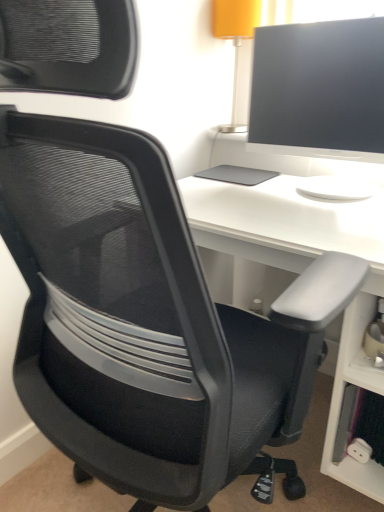
You are a GUI agent. You are given a task and a screenshot of the screen. Output one action in this format:
    pyautogui.click(x=<x>, y=<y>)
    Task: Click on the matte black monitor at upper right
    The width and height of the screenshot is (384, 512).
    Given the screenshot: What is the action you would take?
    pyautogui.click(x=320, y=89)

Measure the distance between point (373,59) and camera.

Point (373,59) and camera are 39.06 inches apart.

Describe the element at coordinates (320, 89) in the screenshot. This screenshot has height=512, width=384. I see `matte black monitor at upper right` at that location.

The width and height of the screenshot is (384, 512). What do you see at coordinates (302, 271) in the screenshot? I see `white matte desk at center` at bounding box center [302, 271].

Where is `white matte desk at center`? The height and width of the screenshot is (512, 384). white matte desk at center is located at coordinates (302, 271).

At what (x,y) coordinates should I click in order to perform the action: click on matte black monitor at upper right. Please return your answer as a coordinate pair (x, y). Looking at the image, I should click on (320, 89).

Can you confirm if matte black monitor at upper right is positioned to the right of white matte desk at center?

Correct, you'll find matte black monitor at upper right to the right of white matte desk at center.

Does matte black monitor at upper right lie behind white matte desk at center?

Yes, matte black monitor at upper right is behind white matte desk at center.

Which is behind, point (365, 115) or point (213, 217)?

The point (365, 115) is more distant.

From the image's perspective, is matte black monitor at upper right below white matte desk at center?

No, from the image's perspective, matte black monitor at upper right is not below white matte desk at center.

From a real-world perspective, does matte black monitor at upper right sit lower than white matte desk at center?

No, from a real-world perspective, matte black monitor at upper right is not below white matte desk at center.

Considering the sizes of objects matte black monitor at upper right and white matte desk at center in the image provided, who is wider, matte black monitor at upper right or white matte desk at center?

With larger width is white matte desk at center.

Is matte black monitor at upper right taller than white matte desk at center?

Incorrect, the height of matte black monitor at upper right is not larger of that of white matte desk at center.

Who is bigger, matte black monitor at upper right or white matte desk at center?

white matte desk at center is bigger.

Can we say matte black monitor at upper right lies outside white matte desk at center?

Indeed, matte black monitor at upper right is completely outside white matte desk at center.

Is matte black monitor at upper right placed right next to white matte desk at center?

No, matte black monitor at upper right is not making contact with white matte desk at center.

Is matte black monitor at upper right oriented towards white matte desk at center?

No, matte black monitor at upper right does not turn towards white matte desk at center.

What's the angular difference between matte black monitor at upper right and white matte desk at center's facing directions?

0.792 degrees separate the facing orientations of matte black monitor at upper right and white matte desk at center.

Where is `desk below the matte black monitor at upper right (from a real-world perspective)`? desk below the matte black monitor at upper right (from a real-world perspective) is located at coordinates (302, 271).

Which object is positioned more to the left, white matte desk at center or matte black monitor at upper right?

From the viewer's perspective, white matte desk at center appears more on the left side.

Does white matte desk at center lie behind matte black monitor at upper right?

No, the depth of white matte desk at center is less than that of matte black monitor at upper right.

Considering the positions of point (253, 231) and point (361, 140), is point (253, 231) closer or farther from the camera than point (361, 140)?

Point (253, 231) is closer to the camera than point (361, 140).

Looking at this image, from the image's perspective, relative to matte black monitor at upper right, is white matte desk at center above or below?

white matte desk at center is situated lower than matte black monitor at upper right in the image.

From a real-world perspective, is white matte desk at center on top of matte black monitor at upper right?

Actually, white matte desk at center is physically below matte black monitor at upper right in the real world.

Which of these two, white matte desk at center or matte black monitor at upper right, is wider?

With larger width is white matte desk at center.

Between white matte desk at center and matte black monitor at upper right, which one has less height?

With less height is matte black monitor at upper right.

Is white matte desk at center smaller than matte black monitor at upper right?

Incorrect, white matte desk at center is not smaller in size than matte black monitor at upper right.

Is matte black monitor at upper right completely or partially inside white matte desk at center?

Definitely not — matte black monitor at upper right is not inside white matte desk at center.

Is white matte desk at center far from matte black monitor at upper right?

white matte desk at center is actually quite close to matte black monitor at upper right.

Is white matte desk at center oriented towards matte black monitor at upper right?

No, white matte desk at center is not aimed at matte black monitor at upper right.

This screenshot has height=512, width=384. Identify the location of computer monitor behind the white matte desk at center. (320, 89).

Where is `computer monitor that is on the right side of white matte desk at center`? The width and height of the screenshot is (384, 512). computer monitor that is on the right side of white matte desk at center is located at coordinates (320, 89).

The width and height of the screenshot is (384, 512). Identify the location of desk on the left of the matte black monitor at upper right. (302, 271).